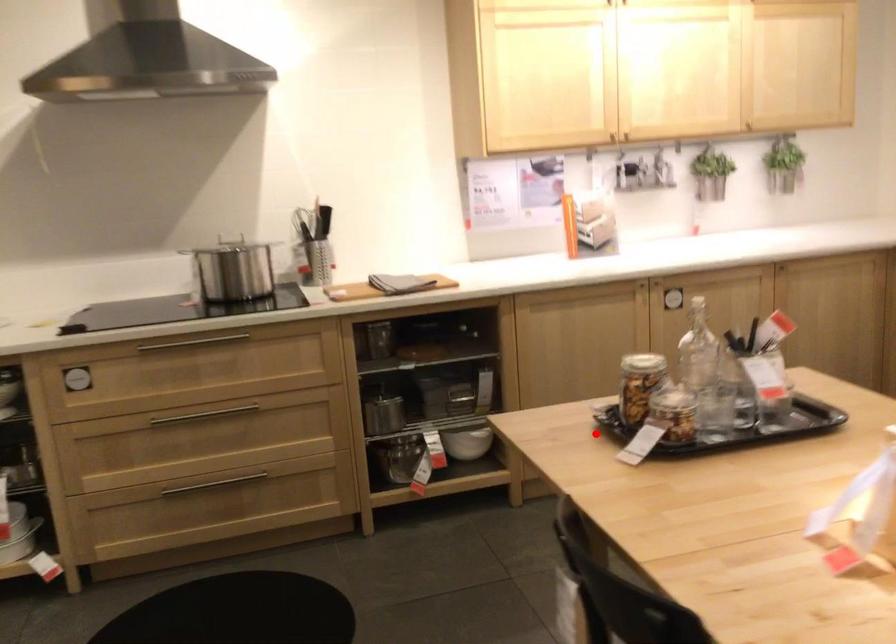
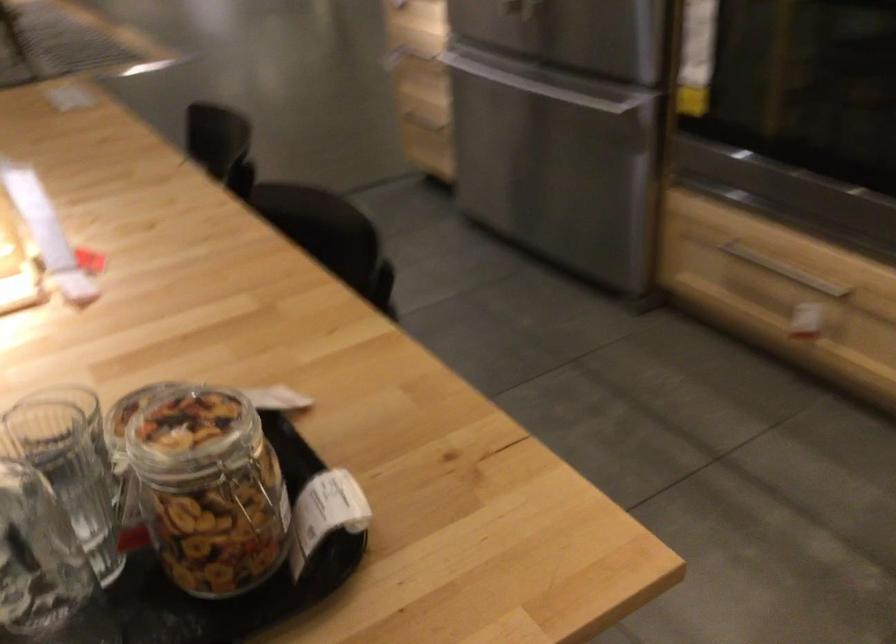
Locate, in the second image, the point that corresponds to the highlighted location in the first image.

(293, 453)